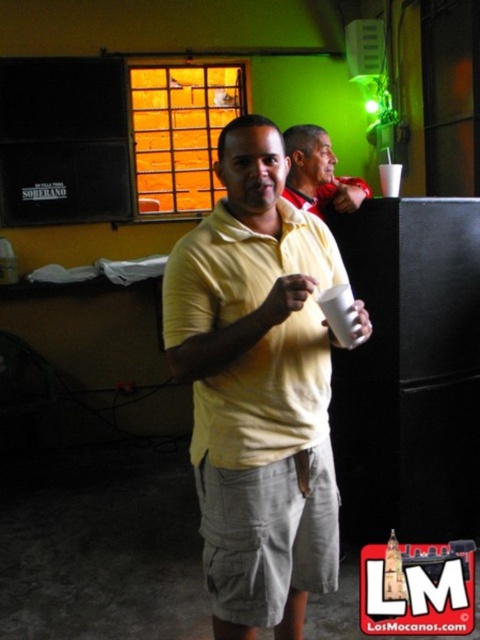
You are organizing a clothing display and need to arrange the yellow cotton shirt at center and the yellow matte shirt at center based on their positions in the image. Which shirt should be placed lower on the display rack?

The yellow cotton shirt at center should be placed lower on the display rack because it is positioned under the yellow matte shirt at center in the image.

In the scene shown: You are a photographer trying to capture both the yellow cotton shirt at center and the yellow matte shirt at center in a single shot. Which shirt should you focus on to ensure the other remains in the background?

You should focus on the yellow cotton shirt at center because it is closer to the viewer, allowing the yellow matte shirt at center to naturally fall into the background.